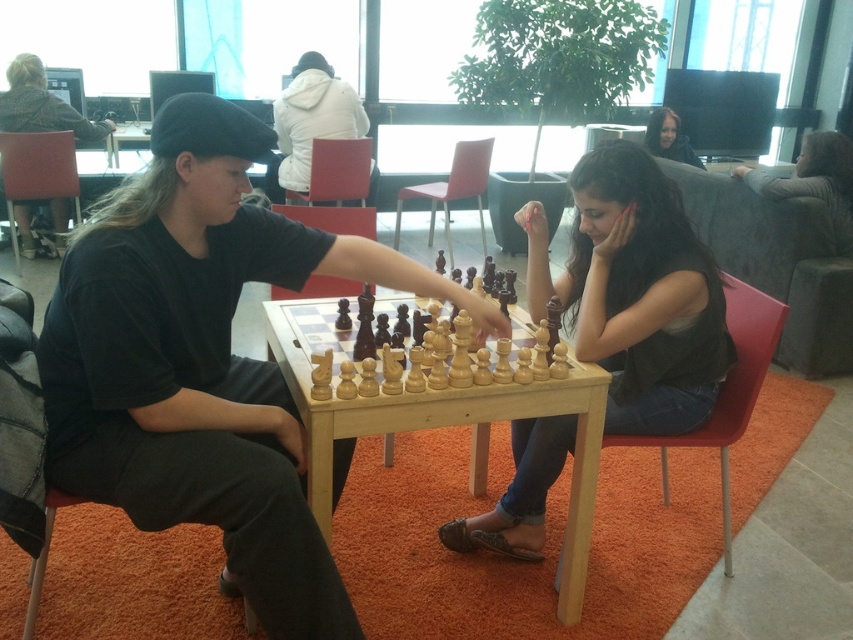
Question: Is white matte jacket at upper center above black cotton shirt at left?

Choices:
 (A) yes
 (B) no

Answer: (B)

Question: Estimate the real-world distances between objects in this image. Which object is farther from the matte black hair at upper center?

Choices:
 (A) matte black shirt at center
 (B) black cotton shirt at left
 (C) white matte jacket at upper center

Answer: (A)

Question: Which is farther from the wooden chess pieces at center?

Choices:
 (A) matte black shirt at center
 (B) white matte jacket at upper center
 (C) black cotton shirt at left
 (D) matte black hair at upper center

Answer: (C)

Question: Can you confirm if matte black shirt at center is thinner than white matte jacket at upper center?

Choices:
 (A) no
 (B) yes

Answer: (A)

Question: Is matte black shirt at center below black cotton shirt at left?

Choices:
 (A) no
 (B) yes

Answer: (B)

Question: Among these objects, which one is farthest from the camera?

Choices:
 (A) wooden chess pieces at center
 (B) matte black hair at upper center
 (C) matte black shirt at center
 (D) black cotton shirt at left

Answer: (B)